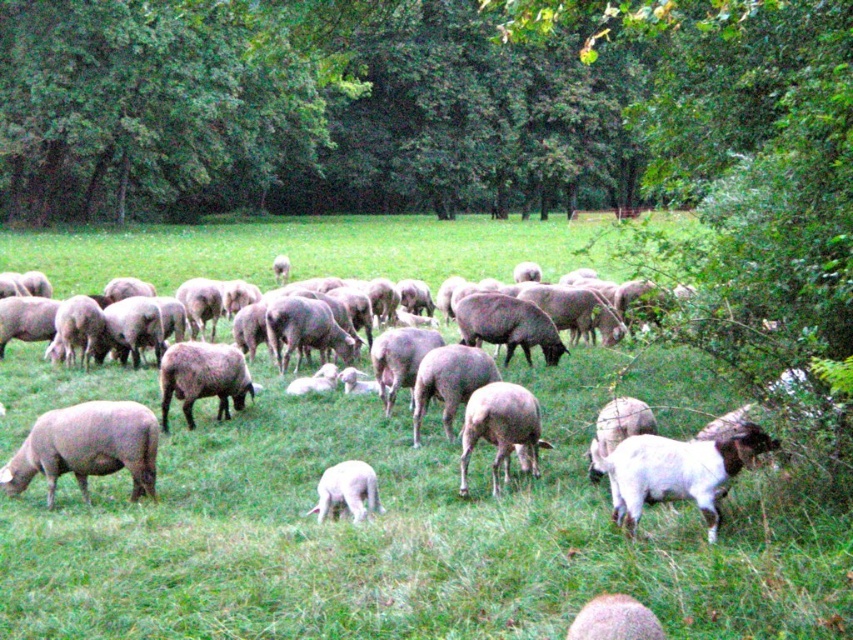
Question: Which is farther from the white woolen sheep at lower right?

Choices:
 (A) green leafy tree at upper left
 (B) fuzzy woolly sheep at lower center
 (C) green grassy field at center
 (D) gray woolen sheep at center

Answer: (A)

Question: Is the position of fuzzy woolly sheep at lower center less distant than that of white woolen lamb at center?

Choices:
 (A) no
 (B) yes

Answer: (B)

Question: Can you confirm if gray woolen sheep at center is bigger than fuzzy woolly sheep at lower center?

Choices:
 (A) yes
 (B) no

Answer: (A)

Question: Among these objects, which one is nearest to the camera?

Choices:
 (A) green leafy tree at upper center
 (B) gray woolly sheep at lower left

Answer: (A)

Question: Which is farther from the green grassy field at center?

Choices:
 (A) green leafy tree at upper center
 (B) fuzzy woolly sheep at lower center

Answer: (A)

Question: Is green leafy tree at upper center positioned at the back of green leafy tree at upper left?

Choices:
 (A) yes
 (B) no

Answer: (B)